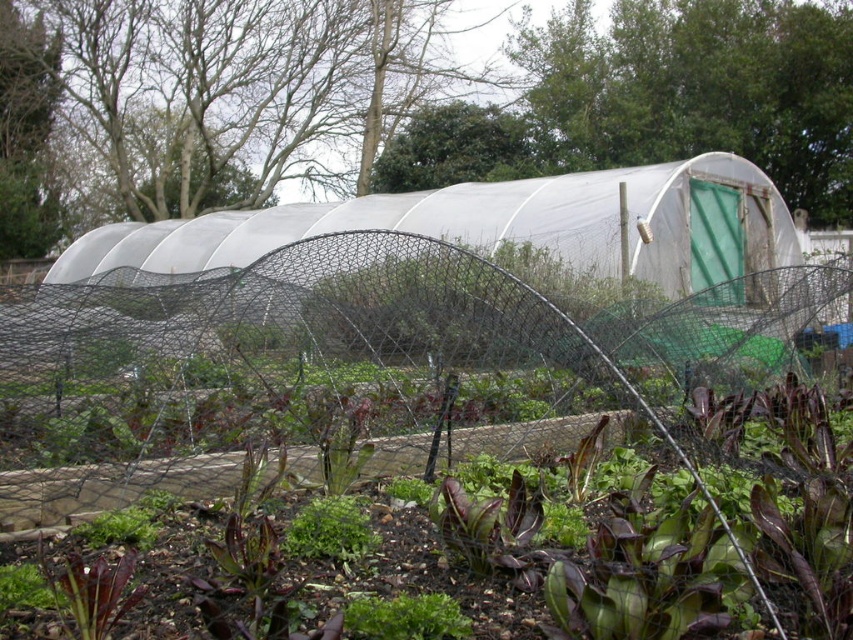
Question: Which of these objects is positioned farthest from the green leafy at center?

Choices:
 (A) green mesh netting at center
 (B) green leafy plant at center

Answer: (A)

Question: Can you confirm if green mesh netting at center is wider than green leafy at center?

Choices:
 (A) no
 (B) yes

Answer: (B)

Question: Is green leafy at center in front of green leafy plant at center?

Choices:
 (A) yes
 (B) no

Answer: (A)

Question: Can you confirm if green leafy at center is positioned to the right of green leafy plant at center?

Choices:
 (A) yes
 (B) no

Answer: (A)

Question: Which of the following is the closest to the observer?

Choices:
 (A) (286, 547)
 (B) (398, 241)

Answer: (A)

Question: Based on their relative distances, which object is farther from the green leafy plant at center?

Choices:
 (A) green mesh netting at center
 (B) green leafy at center

Answer: (A)